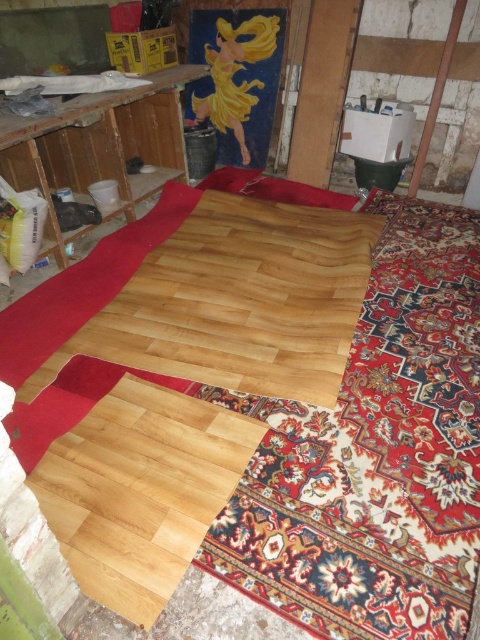
Question: Can you confirm if natural wood floor at center is positioned to the right of natural wood flooring at center?

Choices:
 (A) no
 (B) yes

Answer: (B)

Question: Estimate the real-world distances between objects in this image. Which object is closer to the natural wood floor at center?

Choices:
 (A) natural wood plank at center
 (B) natural wood flooring at center

Answer: (A)

Question: Which object appears closest to the camera in this image?

Choices:
 (A) natural wood floor at center
 (B) natural wood plank at center

Answer: (A)

Question: Can you confirm if natural wood floor at center is smaller than natural wood plank at center?

Choices:
 (A) yes
 (B) no

Answer: (B)

Question: Is natural wood plank at center positioned at the back of natural wood flooring at center?

Choices:
 (A) yes
 (B) no

Answer: (B)

Question: Which object is farther from the camera taking this photo?

Choices:
 (A) natural wood flooring at center
 (B) natural wood floor at center
 (C) natural wood plank at center

Answer: (A)